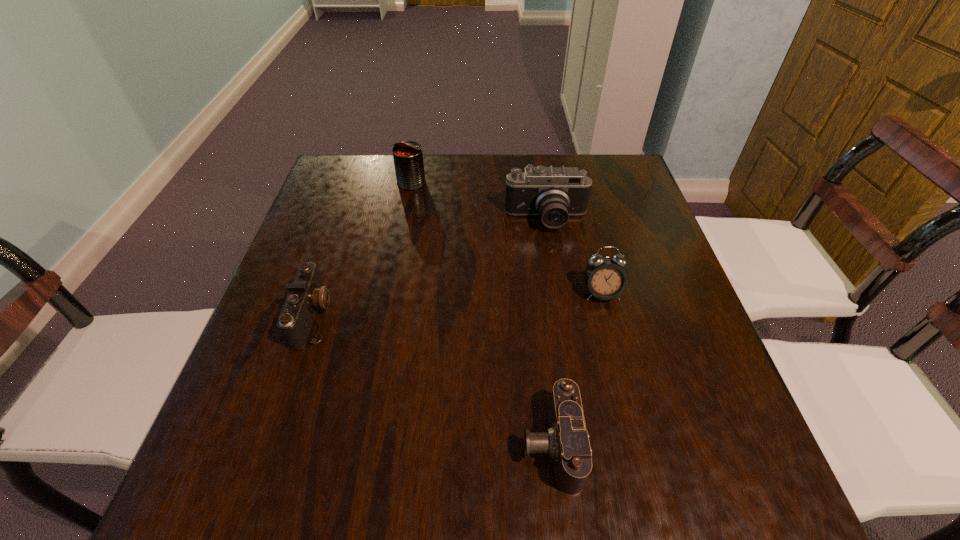
I want to click on free space between the alarm clock and the nearest object, so click(x=576, y=368).

Identify the location of free space between the farthest object and the second farthest camera. This screenshot has height=540, width=960. (363, 249).

Locate an element on the screen. vacant space that's between the nearest object and the alarm clock is located at coordinates (576, 368).

I want to click on free space between the can and the alarm clock, so click(x=507, y=238).

Identify the location of free space between the farthest object and the second farthest object. The height and width of the screenshot is (540, 960). (479, 201).

Choose which object is the fourth nearest neighbor to the second nearest camera. Please provide its 2D coordinates. Your answer should be formatted as a tuple, i.e. [(x, y)], where the tuple contains the x and y coordinates of a point satisfying the conditions above.

[(605, 278)]

Choose which object is the nearest neighbor to the nearest camera. Please provide its 2D coordinates. Your answer should be formatted as a tuple, i.e. [(x, y)], where the tuple contains the x and y coordinates of a point satisfying the conditions above.

[(605, 278)]

Find the location of a particular element. camera that is the closest to the nearest camera is located at coordinates (307, 293).

You are a GUI agent. You are given a task and a screenshot of the screen. Output one action in this format:
    pyautogui.click(x=<x>, y=<y>)
    Task: Click on the camera that stands as the third closest to the alarm clock
    The width and height of the screenshot is (960, 540).
    Given the screenshot: What is the action you would take?
    pyautogui.click(x=307, y=293)

Where is `vacant area in the image that satisfies the following two spatial constraints: 1. on the face of the third shortest object; 2. on the front-facing side of the leftmost object`? vacant area in the image that satisfies the following two spatial constraints: 1. on the face of the third shortest object; 2. on the front-facing side of the leftmost object is located at coordinates (608, 316).